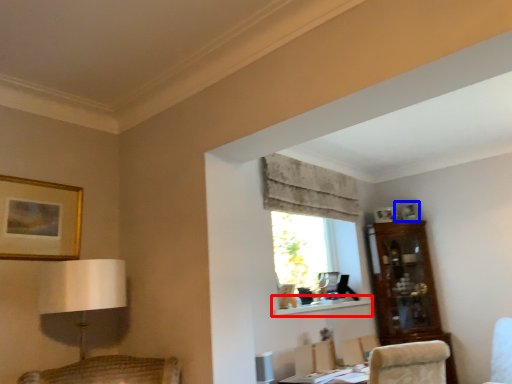
Question: Which point is closer to the camera, shelf (highlighted by a red box) or picture frame (highlighted by a blue box)?

Choices:
 (A) shelf
 (B) picture frame

Answer: (A)